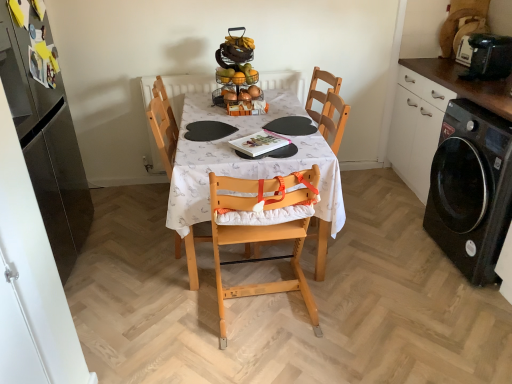
Identify the location of free space in front of white fabric table at center. (263, 336).